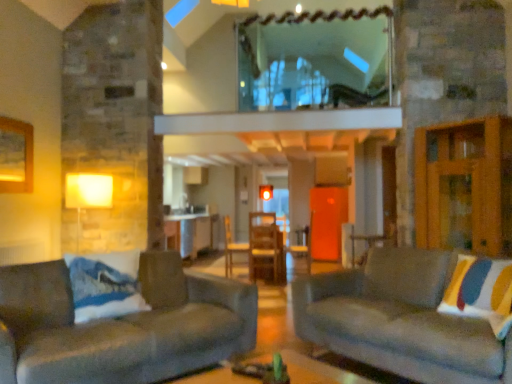
Question: Is metallic silver table at center bigger than wooden chair at center?

Choices:
 (A) no
 (B) yes

Answer: (B)

Question: Does metallic silver table at center come in front of wooden chair at center?

Choices:
 (A) yes
 (B) no

Answer: (B)

Question: Does metallic silver table at center have a smaller size compared to wooden chair at center?

Choices:
 (A) no
 (B) yes

Answer: (A)

Question: Is metallic silver table at center outside of wooden chair at center?

Choices:
 (A) no
 (B) yes

Answer: (B)

Question: Considering the relative sizes of metallic silver table at center and wooden chair at center in the image provided, is metallic silver table at center thinner than wooden chair at center?

Choices:
 (A) no
 (B) yes

Answer: (A)

Question: From a real-world perspective, is metallic silver table at center beneath wooden chair at center?

Choices:
 (A) no
 (B) yes

Answer: (A)

Question: From a real-world perspective, is wooden chair at center positioned under velvet gray couch at left, positioned as the first studio couch in left-to-right order, based on gravity?

Choices:
 (A) no
 (B) yes

Answer: (A)

Question: Is wooden chair at center in front of velvet gray couch at left, positioned as the first studio couch in left-to-right order?

Choices:
 (A) no
 (B) yes

Answer: (A)

Question: Can you confirm if wooden chair at center is thinner than velvet gray couch at left, acting as the 2th studio couch starting from the right?

Choices:
 (A) yes
 (B) no

Answer: (A)

Question: Is wooden chair at center smaller than velvet gray couch at left, acting as the 2th studio couch starting from the right?

Choices:
 (A) no
 (B) yes

Answer: (B)

Question: Could you tell me if wooden chair at center is facing velvet gray couch at left, positioned as the first studio couch in left-to-right order?

Choices:
 (A) no
 (B) yes

Answer: (A)

Question: From a real-world perspective, is wooden chair at center located higher than velvet gray couch at left, acting as the 2th studio couch starting from the right?

Choices:
 (A) no
 (B) yes

Answer: (B)

Question: From a real-world perspective, is velvet gray couch at left, acting as the 2th studio couch starting from the right, below velvet gray couch at right, the 1th studio couch viewed from the right?

Choices:
 (A) no
 (B) yes

Answer: (A)